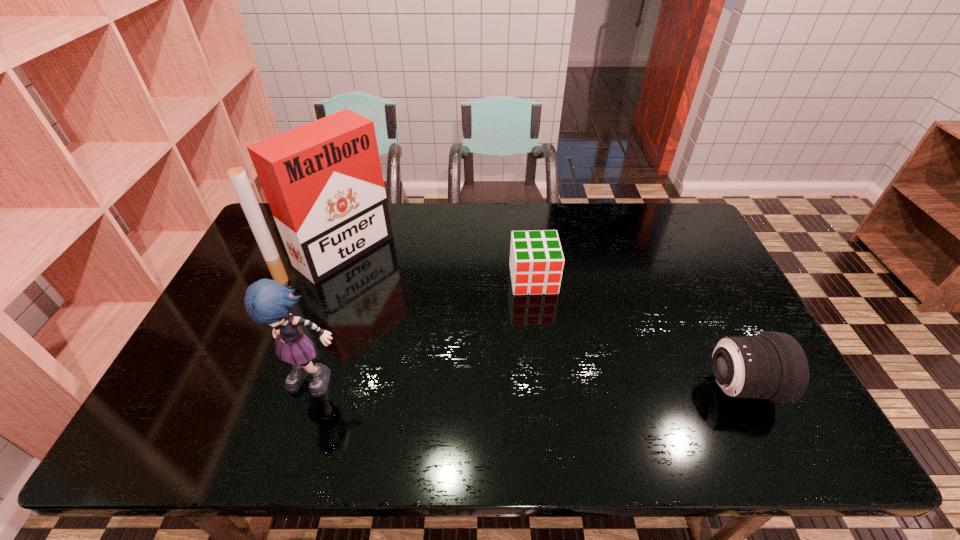
Identify the location of vacant space that satisfies the following two spatial constraints: 1. on the front-facing side of the third tallest object; 2. at the front element of the rag doll. pyautogui.click(x=317, y=387).

Locate an element on the screen. vacant area in the image that satisfies the following two spatial constraints: 1. on the front-facing side of the second shortest object; 2. at the front element of the rag doll is located at coordinates (317, 387).

Locate an element on the screen. blank area in the image that satisfies the following two spatial constraints: 1. on the front side of the rightmost object; 2. at the front element of the third object from left to right is located at coordinates (546, 387).

The width and height of the screenshot is (960, 540). Find the location of `vacant area in the image that satisfies the following two spatial constraints: 1. on the front-facing side of the rag doll; 2. at the front element of the second shortest object`. vacant area in the image that satisfies the following two spatial constraints: 1. on the front-facing side of the rag doll; 2. at the front element of the second shortest object is located at coordinates (317, 387).

Find the location of a particular element. This screenshot has width=960, height=540. free point that satisfies the following two spatial constraints: 1. on the front side of the cigarette case; 2. at the front element of the rightmost object is located at coordinates (292, 387).